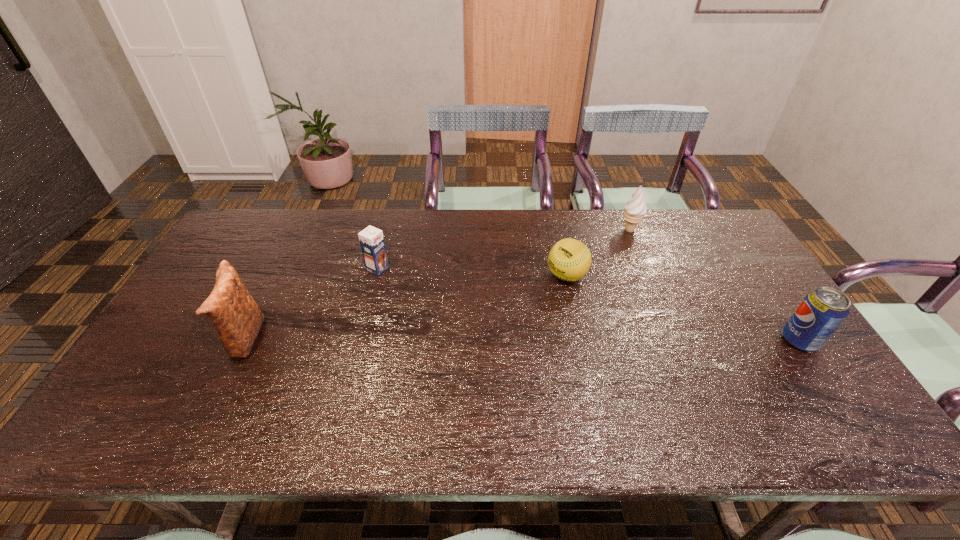
Find the location of a particular element. free space located on the left of the rightmost object is located at coordinates (760, 340).

Locate an element on the screen. The image size is (960, 540). free spot located on the logo side of the third object from right to left is located at coordinates (492, 327).

Where is `free spot located on the logo side of the third object from right to left`? This screenshot has width=960, height=540. free spot located on the logo side of the third object from right to left is located at coordinates (523, 306).

This screenshot has width=960, height=540. Find the location of `free region located on the logo side of the third object from right to left`. free region located on the logo side of the third object from right to left is located at coordinates pyautogui.click(x=506, y=318).

Identify the location of vacant space located 0.140m on the front-facing side of the farthest object. (607, 256).

This screenshot has height=540, width=960. I want to click on vacant space located 0.150m on the front-facing side of the farthest object, so click(x=605, y=257).

Where is `vacant space positioned 0.270m on the front-facing side of the farthest object`? vacant space positioned 0.270m on the front-facing side of the farthest object is located at coordinates (588, 278).

The image size is (960, 540). I want to click on vacant space situated on the front label of the second object from left to right, so click(475, 315).

The height and width of the screenshot is (540, 960). I want to click on free spot located on the front label of the second object from left to right, so click(x=417, y=287).

Locate an element on the screen. The height and width of the screenshot is (540, 960). vacant region located 0.280m on the front label of the second object from left to right is located at coordinates (461, 308).